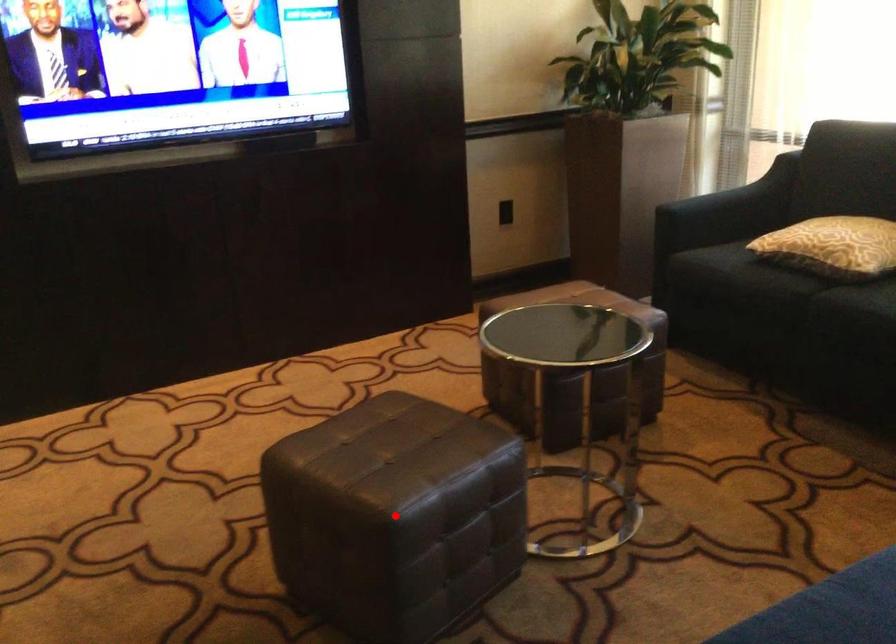
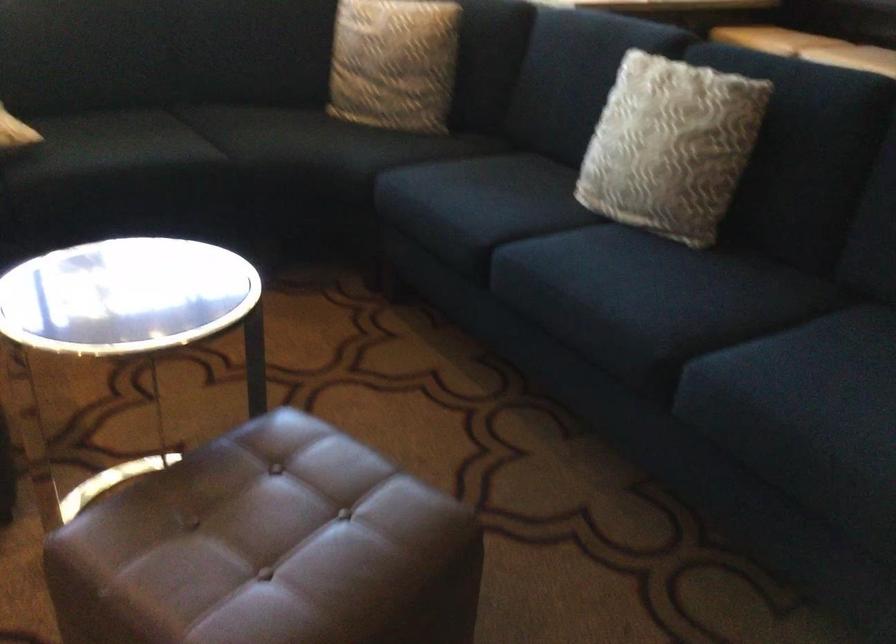
Question: I am providing you with two images of the same scene from different viewpoints. Image1 has a red point marked. In image2, the corresponding 3D location appears at what relative position? Reply with the corresponding letter.

Choices:
 (A) Closer
 (B) Farther

Answer: (B)